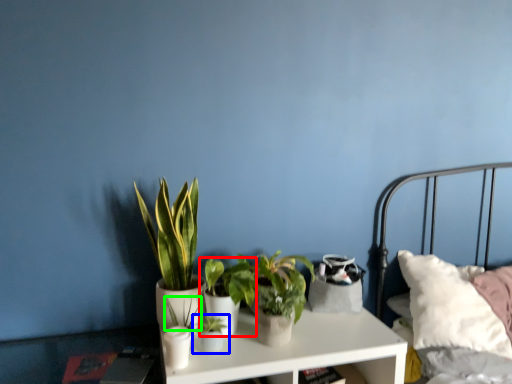
Question: Which object is the closest to the houseplant (highlighted by a red box)? Choose among these: houseplant (highlighted by a blue box) or plant (highlighted by a green box).

Choices:
 (A) houseplant
 (B) plant

Answer: (A)